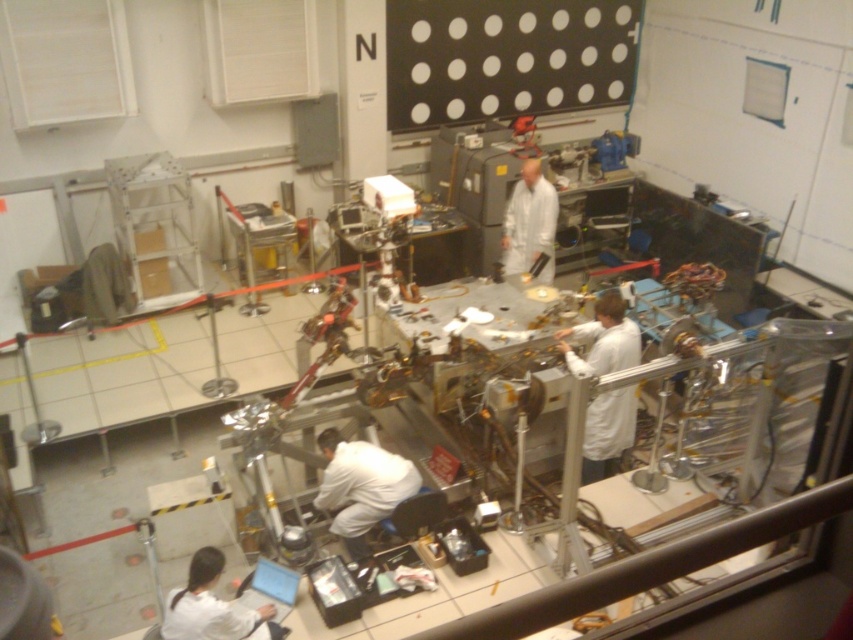
Based on the photo, between white lab coat at right and white lab coat at lower left, which one appears on the right side from the viewer's perspective?

Positioned to the right is white lab coat at right.

Which is below, white lab coat at right or white lab coat at lower left?

white lab coat at lower left is lower down.

What do you see at coordinates (602, 339) in the screenshot? I see `white lab coat at right` at bounding box center [602, 339].

At what (x,y) coordinates should I click in order to perform the action: click on white lab coat at right. Please return your answer as a coordinate pair (x, y). This screenshot has width=853, height=640. Looking at the image, I should click on (602, 339).

Is white matte lab coat at lower center closer to camera compared to white lab coat at lower left?

No.

Does point (323, 500) come closer to viewer compared to point (260, 627)?

No, it is not.

I want to click on white matte lab coat at lower center, so click(x=360, y=486).

Locate an element on the screen. This screenshot has width=853, height=640. white matte lab coat at lower center is located at coordinates (360, 486).

Who is higher up, white lab coat at right or white matte lab coat at lower center?

white lab coat at right

Is point (604, 444) closer to viewer compared to point (398, 467)?

No.

You are a GUI agent. You are given a task and a screenshot of the screen. Output one action in this format:
    pyautogui.click(x=<x>, y=<y>)
    Task: Click on the white lab coat at right
    The image size is (853, 640).
    Given the screenshot: What is the action you would take?
    pyautogui.click(x=602, y=339)